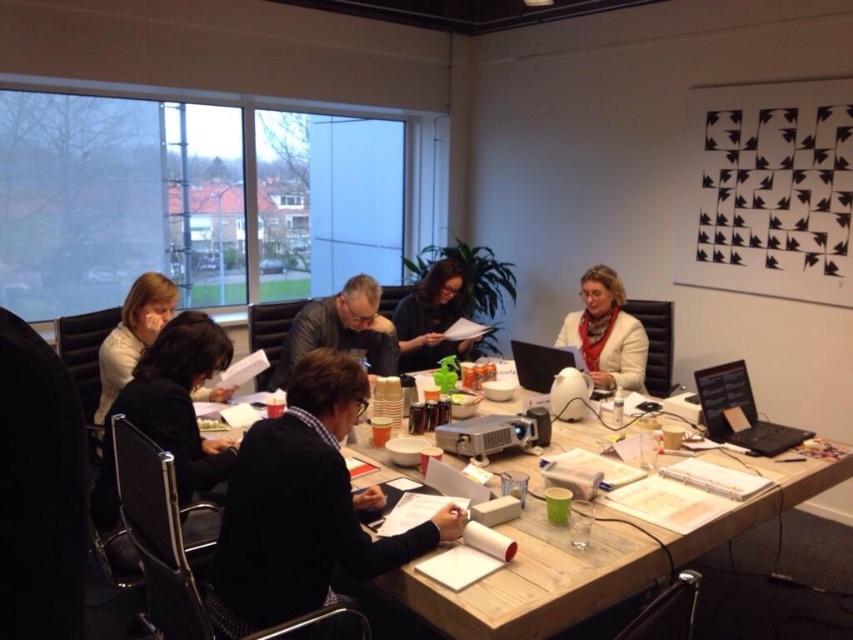
You are organizing a coat rack for a meeting and need to hang the black fabric jacket at lower left and the white leather jacket at center. Since the coat rack has limited vertical space, which jacket should you place higher up to ensure both fit without overlapping?

The black fabric jacket at lower left is taller than the white leather jacket at center, so place the black fabric jacket at lower left higher up on the coat rack to accommodate its height, allowing the white leather jacket at center to fit below without overlapping.

You are organizing a presentation and need to place the black plastic laptop at lower right on the table. However, there is a white leather jacket at center taking up space. Can you fit the laptop next to the jacket without moving it?

The white leather jacket at center is larger in size than the black plastic laptop at lower right, so there should be enough space to place the laptop next to the jacket without moving it.